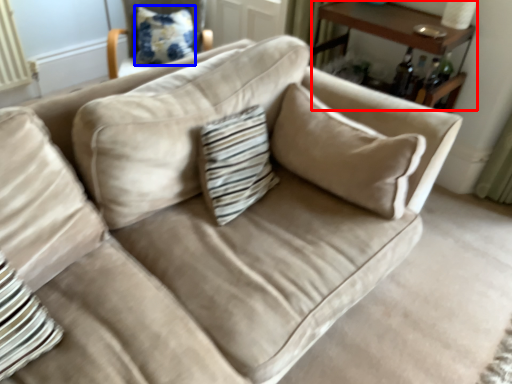
Question: Which object is further to the camera taking this photo, table (highlighted by a red box) or pillow (highlighted by a blue box)?

Choices:
 (A) table
 (B) pillow

Answer: (B)